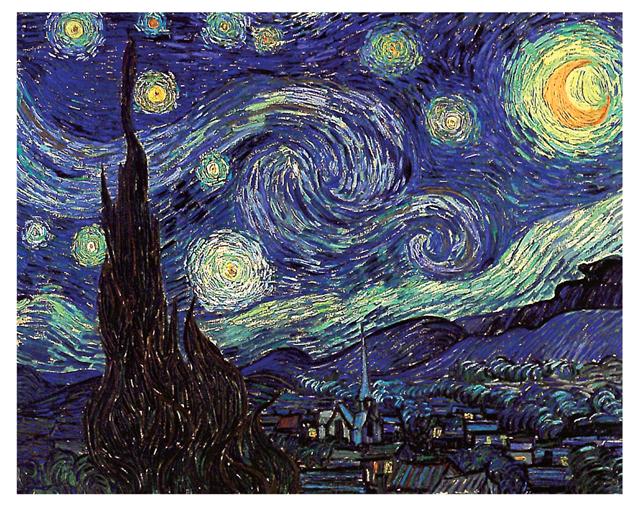
Image resolution: width=640 pixels, height=508 pixels. I want to click on lights, so point(312,427), point(383,467), point(372,466), point(365,472), point(438,432), point(468,414), point(518,458), point(564,459), point(486,439), point(500,438).